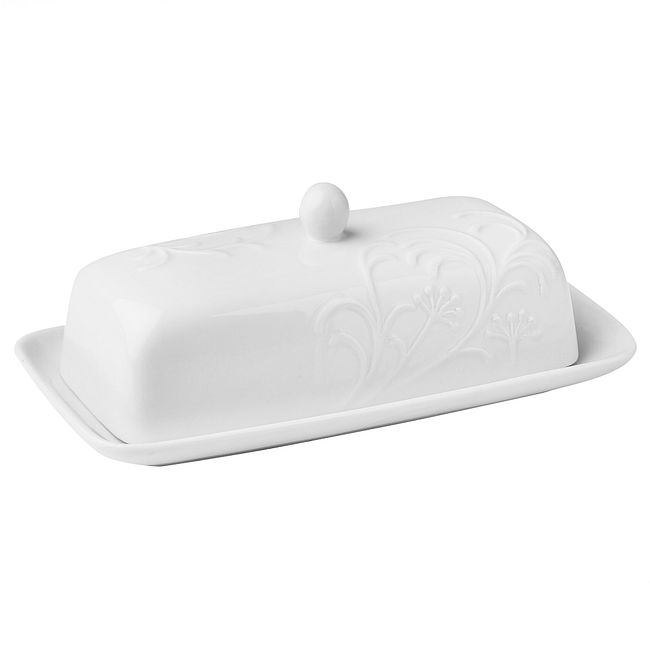
Where is `dish cover`? The width and height of the screenshot is (650, 650). dish cover is located at coordinates (161, 357).